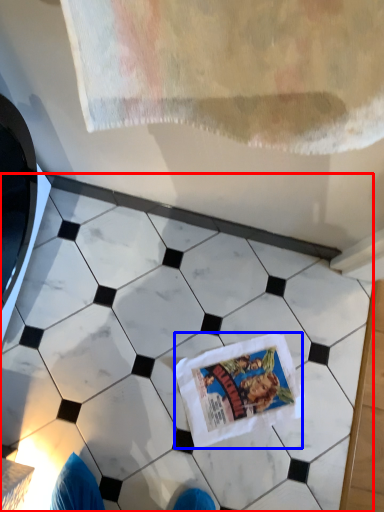
Question: Which of the following is the closest to the observer, marble (highlighted by a red box) or comic book (highlighted by a blue box)?

Choices:
 (A) marble
 (B) comic book

Answer: (A)